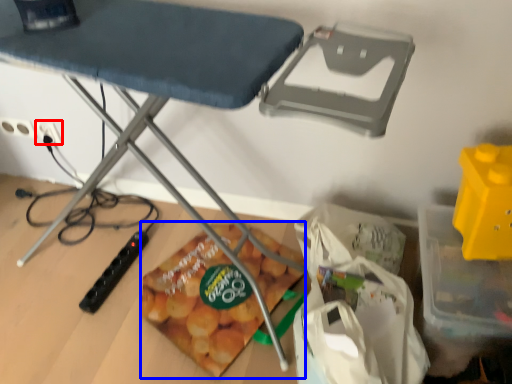
Question: Which object appears farthest to the camera in this image, electric outlet (highlighted by a red box) or snack (highlighted by a blue box)?

Choices:
 (A) electric outlet
 (B) snack

Answer: (A)